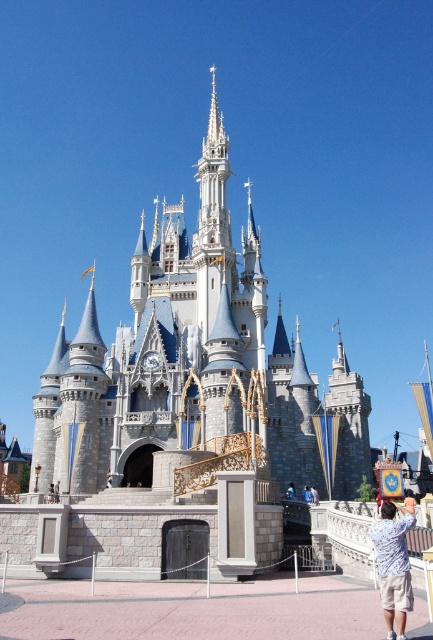
Question: Can you confirm if gray stone castle at center is positioned to the left of light blue shirt at lower right?

Choices:
 (A) no
 (B) yes

Answer: (B)

Question: Is gray stone castle at center positioned in front of light blue shirt at lower right?

Choices:
 (A) no
 (B) yes

Answer: (A)

Question: Among these points, which one is nearest to the camera?

Choices:
 (A) pos(151,241)
 (B) pos(397,506)

Answer: (B)

Question: Which of the following is the closest to the observer?

Choices:
 (A) (61, 342)
 (B) (388, 595)

Answer: (B)

Question: Is gray stone castle at center further to camera compared to light blue shirt at lower right?

Choices:
 (A) yes
 (B) no

Answer: (A)